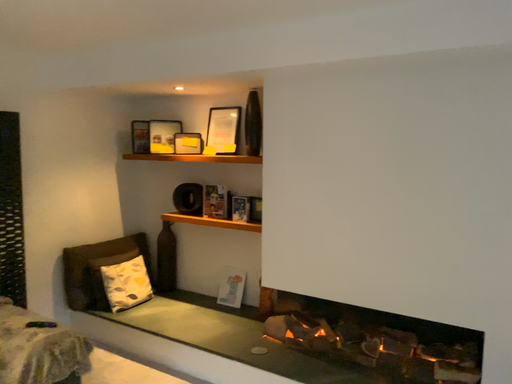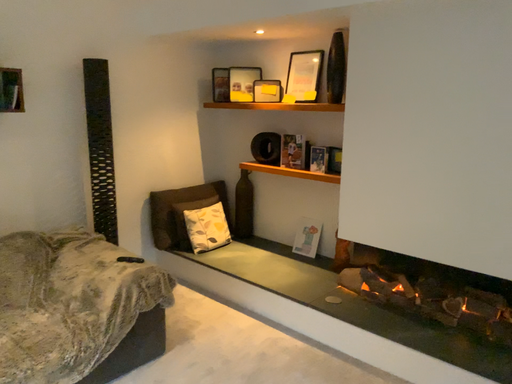
Question: How did the camera likely rotate when shooting the video?

Choices:
 (A) rotated right
 (B) rotated left

Answer: (B)